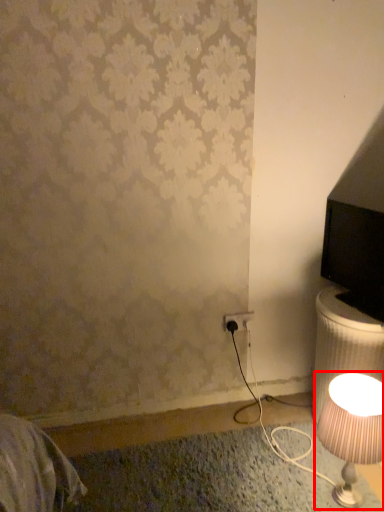
Question: From the image's perspective, what is the correct spatial relationship of lamp (annotated by the red box) in relation to electric outlet?

Choices:
 (A) below
 (B) above

Answer: (A)